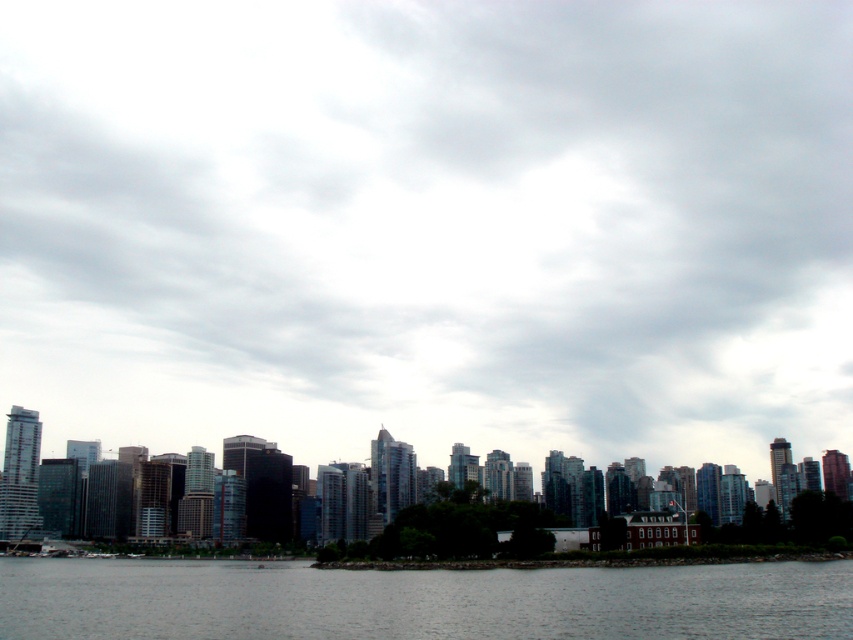
Question: Among these objects, which one is nearest to the camera?

Choices:
 (A) cloudy sky at upper center
 (B) glassy skyscrapers at center

Answer: (B)

Question: Can you confirm if cloudy sky at upper center is positioned to the right of dark gray water at lower center?

Choices:
 (A) no
 (B) yes

Answer: (B)

Question: Is cloudy sky at upper center further to the viewer compared to glassy skyscrapers at center?

Choices:
 (A) yes
 (B) no

Answer: (A)

Question: Which is nearer to the glassy skyscrapers at center?

Choices:
 (A) dark gray water at lower center
 (B) cloudy sky at upper center

Answer: (A)

Question: Which object is positioned closest to the glassy skyscrapers at center?

Choices:
 (A) dark gray water at lower center
 (B) cloudy sky at upper center

Answer: (A)

Question: Considering the relative positions of dark gray water at lower center and glassy skyscrapers at center in the image provided, where is dark gray water at lower center located with respect to glassy skyscrapers at center?

Choices:
 (A) right
 (B) left

Answer: (B)